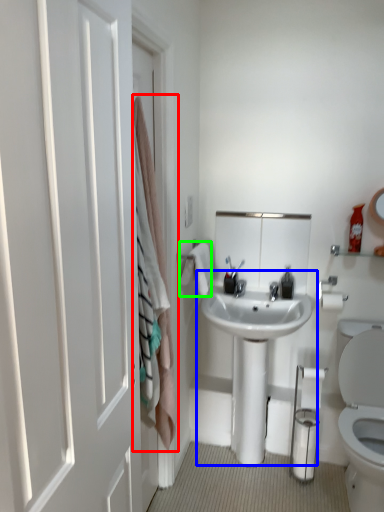
Question: Estimate the real-world distances between objects in this image. Which object is closer to curtain (highlighted by a red box), sink (highlighted by a blue box) or bath towel (highlighted by a green box)?

Choices:
 (A) sink
 (B) bath towel

Answer: (B)